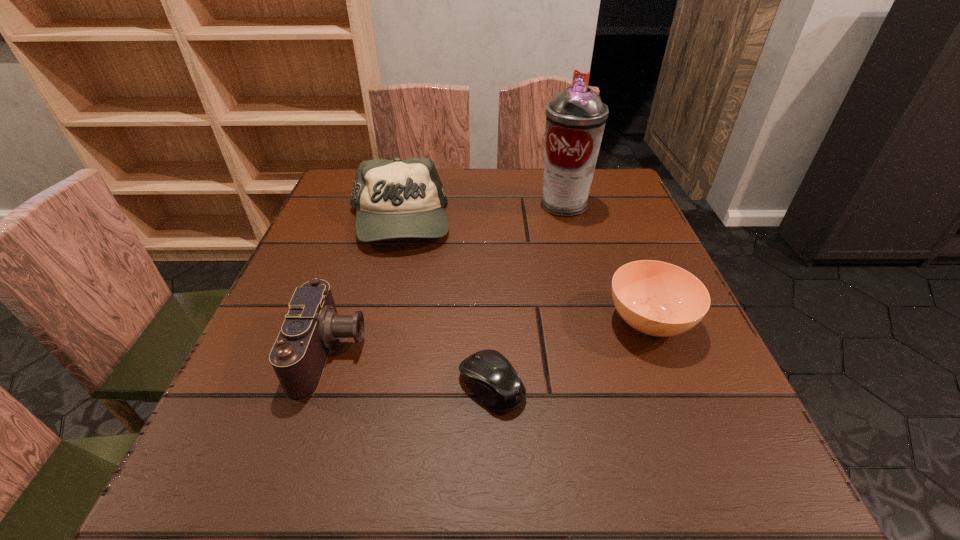
You are a GUI agent. You are given a task and a screenshot of the screen. Output one action in this format:
    pyautogui.click(x=<x>, y=<y>)
    Task: Click on the tallest object
    
    Given the screenshot: What is the action you would take?
    point(575,119)

Locate an element on the screen. The image size is (960, 540). baseball cap is located at coordinates (397, 198).

Identify the location of camera. The width and height of the screenshot is (960, 540). (298, 357).

I want to click on the second shortest object, so coord(656,298).

At what (x,y) coordinates should I click in order to perform the action: click on the third object from left to right. Please return your answer as a coordinate pair (x, y). The image size is (960, 540). Looking at the image, I should click on (488, 374).

Locate an element on the screen. The image size is (960, 540). mouse is located at coordinates (488, 374).

Find the location of a particular element. This screenshot has width=960, height=540. blank space located on the front of the aerosol can is located at coordinates (571, 231).

The image size is (960, 540). In order to click on free space located 0.110m on the front-facing side of the baseball cap in this screenshot , I will do `click(381, 290)`.

You are a GUI agent. You are given a task and a screenshot of the screen. Output one action in this format:
    pyautogui.click(x=<x>, y=<y>)
    Task: Click on the vacant area situated on the front-facing side of the camera
    The height and width of the screenshot is (540, 960).
    Given the screenshot: What is the action you would take?
    pyautogui.click(x=570, y=353)

This screenshot has height=540, width=960. In order to click on vacant area situated on the back of the fourth tallest object in this screenshot , I will do `click(612, 230)`.